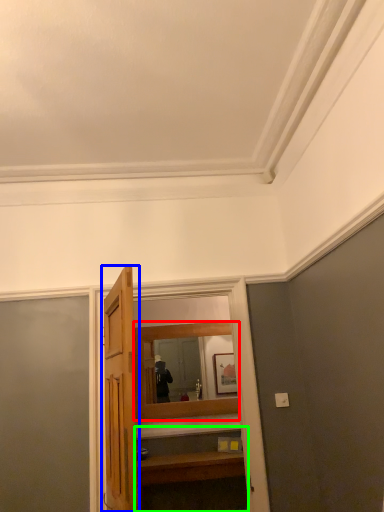
Question: Estimate the real-world distances between objects in this image. Which object is farther from mirror (highlighted by a red box), door (highlighted by a blue box) or vanity (highlighted by a green box)?

Choices:
 (A) door
 (B) vanity

Answer: (A)